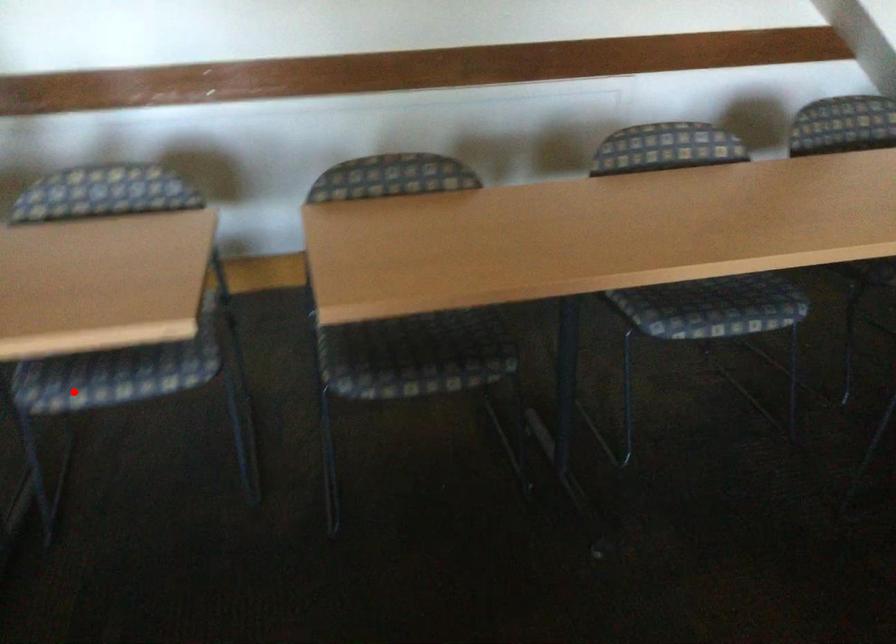
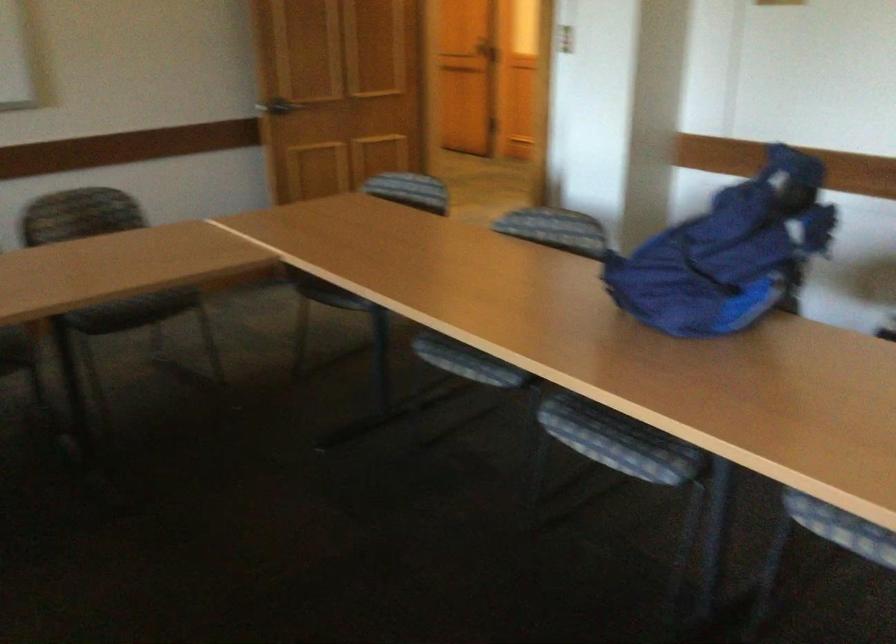
Find the pixel in the second image that matches the highlighted location in the first image.

(840, 527)